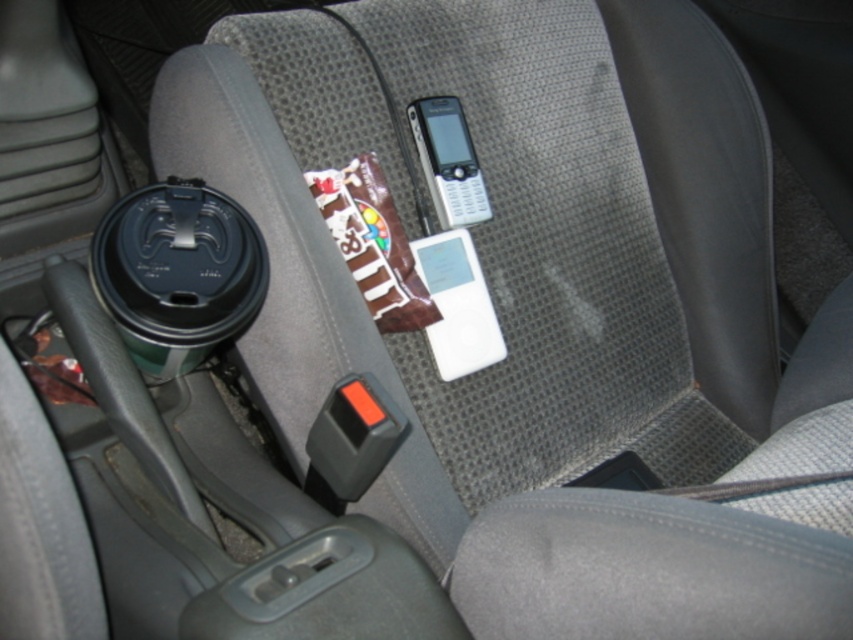
Question: Which point appears closest to the camera in this image?

Choices:
 (A) (422, 161)
 (B) (479, 348)

Answer: (B)

Question: Can you confirm if white matte ipod at center is positioned to the left of silver metallic phone at center?

Choices:
 (A) no
 (B) yes

Answer: (A)

Question: Does white matte ipod at center have a smaller size compared to silver metallic phone at center?

Choices:
 (A) yes
 (B) no

Answer: (B)

Question: Is white matte ipod at center closer to the viewer compared to silver metallic phone at center?

Choices:
 (A) yes
 (B) no

Answer: (A)

Question: Which point is farther to the camera?

Choices:
 (A) (457, 256)
 (B) (447, 152)

Answer: (B)